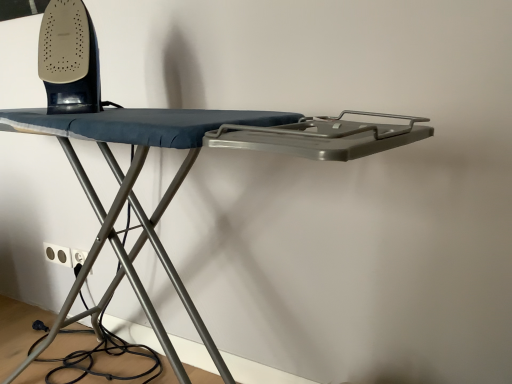
Question: Is white plastic electric outlet at lower left, which is counted as the 1th electric outlet, starting from the right, aimed at white plastic electric outlet at lower left, which is the 2th electric outlet in right-to-left order?

Choices:
 (A) yes
 (B) no

Answer: (B)

Question: Does white plastic electric outlet at lower left, which is counted as the 1th electric outlet, starting from the right, have a larger size compared to white plastic electric outlet at lower left, which is the 2th electric outlet in right-to-left order?

Choices:
 (A) no
 (B) yes

Answer: (B)

Question: Is white plastic electric outlet at lower left, acting as the second electric outlet starting from the left, closer to the viewer compared to white plastic electric outlet at lower left, the first electric outlet in the left-to-right sequence?

Choices:
 (A) yes
 (B) no

Answer: (A)

Question: Is white plastic electric outlet at lower left, which is counted as the 1th electric outlet, starting from the right, oriented away from white plastic electric outlet at lower left, the first electric outlet in the left-to-right sequence?

Choices:
 (A) yes
 (B) no

Answer: (B)

Question: Does white plastic electric outlet at lower left, which is counted as the 1th electric outlet, starting from the right, lie behind white plastic electric outlet at lower left, the first electric outlet in the left-to-right sequence?

Choices:
 (A) yes
 (B) no

Answer: (B)

Question: From the image's perspective, is white plastic electric outlet at lower left, acting as the second electric outlet starting from the left, beneath white plastic electric outlet at lower left, which is the 2th electric outlet in right-to-left order?

Choices:
 (A) yes
 (B) no

Answer: (A)

Question: Is white plastic electric outlet at lower left, which is counted as the 1th electric outlet, starting from the right, closer to camera compared to matte black iron at upper left?

Choices:
 (A) no
 (B) yes

Answer: (A)

Question: Considering the relative sizes of white plastic electric outlet at lower left, acting as the second electric outlet starting from the left, and matte black iron at upper left in the image provided, is white plastic electric outlet at lower left, acting as the second electric outlet starting from the left, wider than matte black iron at upper left?

Choices:
 (A) no
 (B) yes

Answer: (A)

Question: Is white plastic electric outlet at lower left, which is counted as the 1th electric outlet, starting from the right, outside of matte black iron at upper left?

Choices:
 (A) yes
 (B) no

Answer: (A)

Question: Is white plastic electric outlet at lower left, acting as the second electric outlet starting from the left, facing towards matte black iron at upper left?

Choices:
 (A) no
 (B) yes

Answer: (A)

Question: Does white plastic electric outlet at lower left, acting as the second electric outlet starting from the left, have a lesser width compared to matte black iron at upper left?

Choices:
 (A) yes
 (B) no

Answer: (A)

Question: From the image's perspective, is white plastic electric outlet at lower left, which is counted as the 1th electric outlet, starting from the right, above matte black iron at upper left?

Choices:
 (A) yes
 (B) no

Answer: (B)

Question: Is white plastic electric outlet at lower left, which is the 2th electric outlet in right-to-left order, positioned far away from matte black iron at upper left?

Choices:
 (A) no
 (B) yes

Answer: (A)